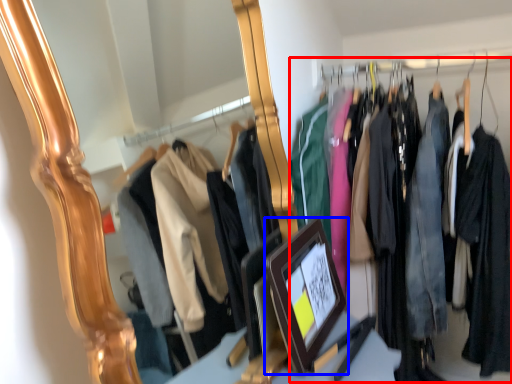
Question: Which of the following is the farthest to the observer, closet (highlighted by a red box) or picture frame (highlighted by a blue box)?

Choices:
 (A) closet
 (B) picture frame

Answer: (A)